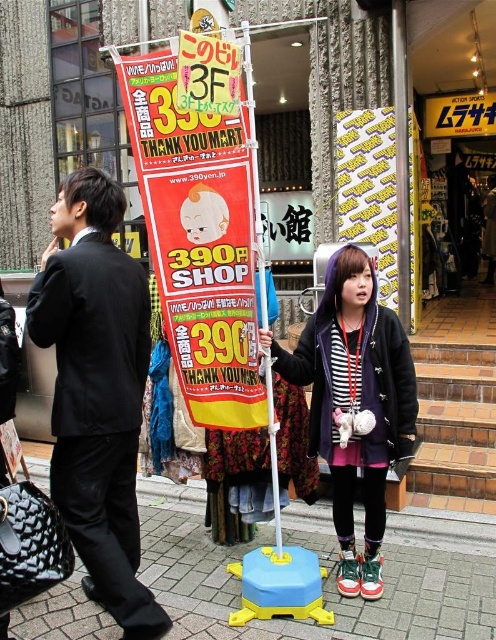
Question: Is black suit at left wider than blue plastic toy at center?

Choices:
 (A) no
 (B) yes

Answer: (B)

Question: Which point is farther to the camera?

Choices:
 (A) (234, 568)
 (B) (295, 554)

Answer: (A)

Question: Does striped fabric hoodie at center have a larger size compared to blue plastic toy at center?

Choices:
 (A) yes
 (B) no

Answer: (A)

Question: Among these points, which one is farthest from the camera?

Choices:
 (A) (272, 596)
 (B) (104, 541)
 (C) (197, 365)
 (D) (409, 593)

Answer: (D)

Question: Among these points, which one is nearest to the camera?

Choices:
 (A) coord(84,289)
 (B) coord(354,582)
 (C) coord(168,282)

Answer: (A)

Question: Is black suit at left thinner than striped fabric hoodie at center?

Choices:
 (A) yes
 (B) no

Answer: (A)